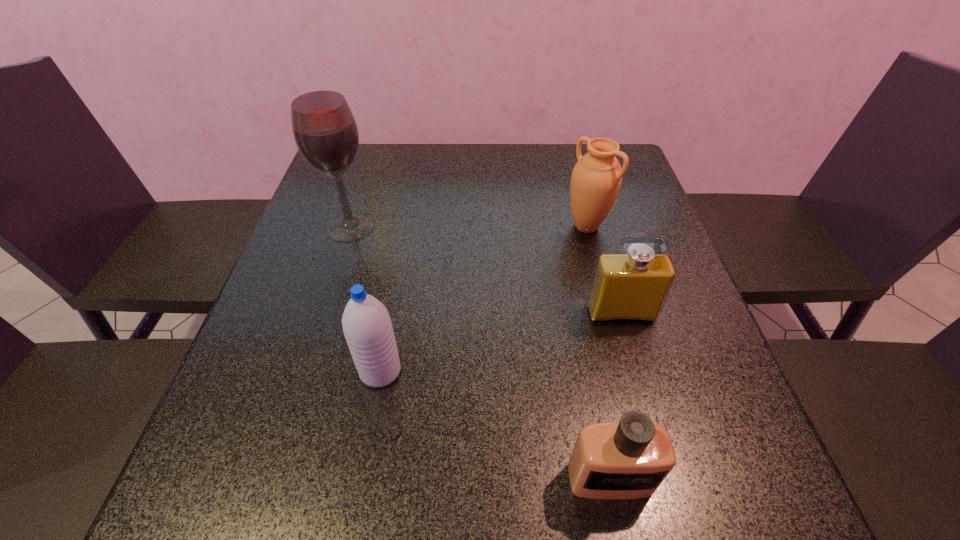
Locate an element on the screen. The width and height of the screenshot is (960, 540). unoccupied position between the nearest object and the third nearest object is located at coordinates (615, 396).

Locate an element on the screen. empty space between the alcohol and the urn is located at coordinates (468, 226).

Where is `vacant space that is in between the nearer perfume and the water bottle`? vacant space that is in between the nearer perfume and the water bottle is located at coordinates (495, 425).

Identify the location of vacant space that is in between the urn and the tallest object. Image resolution: width=960 pixels, height=540 pixels. (468, 226).

Where is `vacant area that lies between the urn and the shortest object`? vacant area that lies between the urn and the shortest object is located at coordinates (598, 353).

The image size is (960, 540). I want to click on vacant space that is in between the farther perfume and the fourth object from right to left, so click(500, 342).

You are a GUI agent. You are given a task and a screenshot of the screen. Output one action in this format:
    pyautogui.click(x=<x>, y=<y>)
    Task: Click on the closest object to the shorter perfume
    This screenshot has height=540, width=960.
    Given the screenshot: What is the action you would take?
    pyautogui.click(x=627, y=287)

Identify which object is the second closest to the alcohol. Please provide its 2D coordinates. Your answer should be formatted as a tuple, i.e. [(x, y)], where the tuple contains the x and y coordinates of a point satisfying the conditions above.

[(596, 179)]

Locate an element on the screen. The width and height of the screenshot is (960, 540). vacant position in the image that satisfies the following two spatial constraints: 1. on the front side of the water bottle; 2. on the left side of the tallest object is located at coordinates (304, 371).

In order to click on vacant region that satisfies the following two spatial constraints: 1. on the back side of the fourth farthest object; 2. on the left side of the urn in this screenshot , I will do `click(407, 226)`.